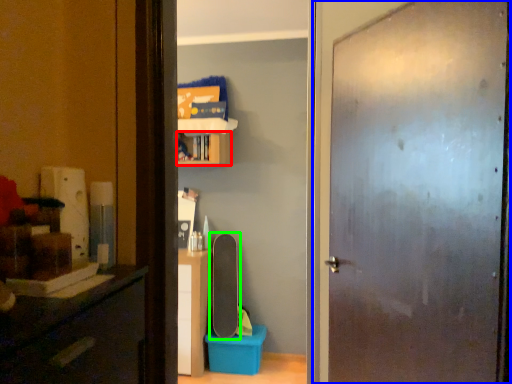
Question: Estimate the real-world distances between objects in this image. Which object is farther from cabinet (highlighted by a red box), door (highlighted by a blue box) or skateboard (highlighted by a green box)?

Choices:
 (A) door
 (B) skateboard

Answer: (A)